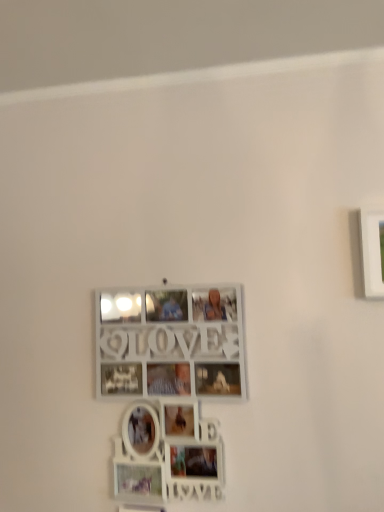
Where is `white matte photo frame at center`? The width and height of the screenshot is (384, 512). white matte photo frame at center is located at coordinates (140, 508).

Describe the element at coordinates (140, 508) in the screenshot. I see `white matte photo frame at center` at that location.

You are a GUI agent. You are given a task and a screenshot of the screen. Output one action in this format:
    pyautogui.click(x=<x>, y=<y>)
    Task: Click on the white matte photo frame at center
    
    Given the screenshot: What is the action you would take?
    pyautogui.click(x=140, y=508)